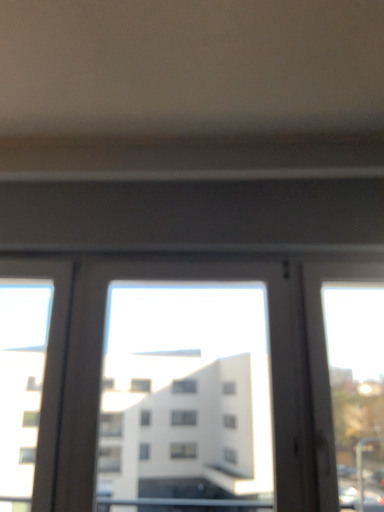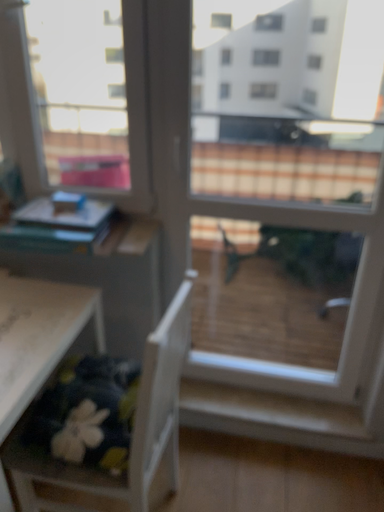
Question: How did the camera likely rotate when shooting the video?

Choices:
 (A) rotated downward
 (B) rotated upward

Answer: (A)